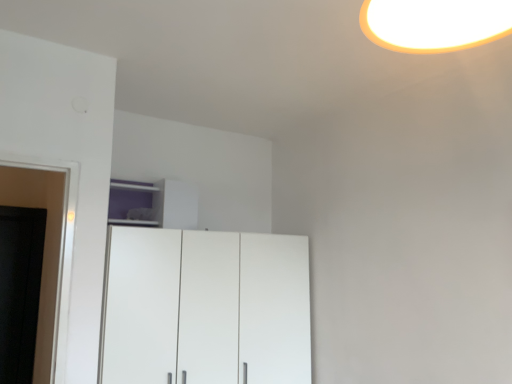
What do you see at coordinates (154, 204) in the screenshot? This screenshot has width=512, height=384. I see `purple matte cabinet at upper center` at bounding box center [154, 204].

This screenshot has width=512, height=384. Find the location of `purple matte cabinet at upper center`. purple matte cabinet at upper center is located at coordinates pyautogui.click(x=154, y=204).

Image resolution: width=512 pixels, height=384 pixels. I want to click on white glossy cupboard at center, so click(206, 308).

The width and height of the screenshot is (512, 384). What do you see at coordinates (206, 308) in the screenshot?
I see `white glossy cupboard at center` at bounding box center [206, 308].

This screenshot has height=384, width=512. In order to click on purple matte cabinet at upper center in this screenshot , I will do `click(154, 204)`.

In the image, is purple matte cabinet at upper center on the left side or the right side of white glossy cupboard at center?

Based on their positions, purple matte cabinet at upper center is located to the left of white glossy cupboard at center.

Is purple matte cabinet at upper center closer to camera compared to white glossy cupboard at center?

No, purple matte cabinet at upper center is further to the viewer.

Is point (127, 206) positioned before point (209, 237)?

That is False.

From the image's perspective, is purple matte cabinet at upper center over white glossy cupboard at center?

Yes.

From a real-world perspective, relative to white glossy cupboard at center, is purple matte cabinet at upper center vertically above or below?

In terms of real-world spatial position, purple matte cabinet at upper center is above white glossy cupboard at center.

Based on the photo, which of these two, purple matte cabinet at upper center or white glossy cupboard at center, is thinner?

purple matte cabinet at upper center is thinner.

Considering the sizes of objects purple matte cabinet at upper center and white glossy cupboard at center in the image provided, who is shorter, purple matte cabinet at upper center or white glossy cupboard at center?

purple matte cabinet at upper center.

Is purple matte cabinet at upper center smaller than white glossy cupboard at center?

Yes.

Is purple matte cabinet at upper center completely or partially outside of white glossy cupboard at center?

Yes, purple matte cabinet at upper center is outside of white glossy cupboard at center.

Are purple matte cabinet at upper center and white glossy cupboard at center beside each other?

No, purple matte cabinet at upper center is not in contact with white glossy cupboard at center.

Based on the photo, is purple matte cabinet at upper center looking in the opposite direction of white glossy cupboard at center?

purple matte cabinet at upper center is not turned away from white glossy cupboard at center.

At what (x,y) coordinates should I click in order to perform the action: click on cupboard on the right of purple matte cabinet at upper center. Please return your answer as a coordinate pair (x, y). This screenshot has height=384, width=512. Looking at the image, I should click on (206, 308).

In the image, is white glossy cupboard at center on the left side or the right side of purple matte cabinet at upper center?

In the image, white glossy cupboard at center appears on the right side of purple matte cabinet at upper center.

Does white glossy cupboard at center come in front of purple matte cabinet at upper center?

Yes, it is in front of purple matte cabinet at upper center.

Which point is more forward, (x=139, y=258) or (x=135, y=219)?

The point (x=139, y=258) is in front.

From the image's perspective, which is above, white glossy cupboard at center or purple matte cabinet at upper center?

purple matte cabinet at upper center is shown above in the image.

Looking at this image, from a real-world perspective, is white glossy cupboard at center positioned above or below purple matte cabinet at upper center?

Clearly, from a real-world perspective, white glossy cupboard at center is below purple matte cabinet at upper center.

Considering the sizes of objects white glossy cupboard at center and purple matte cabinet at upper center in the image provided, who is wider, white glossy cupboard at center or purple matte cabinet at upper center?

Wider between the two is white glossy cupboard at center.

Considering the sizes of objects white glossy cupboard at center and purple matte cabinet at upper center in the image provided, who is shorter, white glossy cupboard at center or purple matte cabinet at upper center?

purple matte cabinet at upper center.

Can you confirm if white glossy cupboard at center is smaller than purple matte cabinet at upper center?

No.

Would you say white glossy cupboard at center contains purple matte cabinet at upper center?

Actually, purple matte cabinet at upper center is outside white glossy cupboard at center.

Looking at this image, would you consider white glossy cupboard at center to be distant from purple matte cabinet at upper center?

white glossy cupboard at center is actually quite close to purple matte cabinet at upper center.

Does white glossy cupboard at center turn towards purple matte cabinet at upper center?

No, white glossy cupboard at center does not turn towards purple matte cabinet at upper center.

How many degrees apart are the facing directions of white glossy cupboard at center and purple matte cabinet at upper center?

There is a 5.08e-05-degree angle between the facing directions of white glossy cupboard at center and purple matte cabinet at upper center.

Locate an element on the screen. cabinetry positioned vertically above the white glossy cupboard at center (from a real-world perspective) is located at coordinates (154, 204).

Where is `cabinetry on the left of white glossy cupboard at center`? The width and height of the screenshot is (512, 384). cabinetry on the left of white glossy cupboard at center is located at coordinates (154, 204).

Locate an element on the screen. cabinetry that appears above the white glossy cupboard at center (from the image's perspective) is located at coordinates (154, 204).